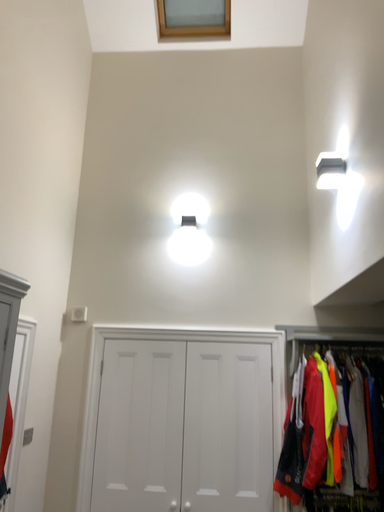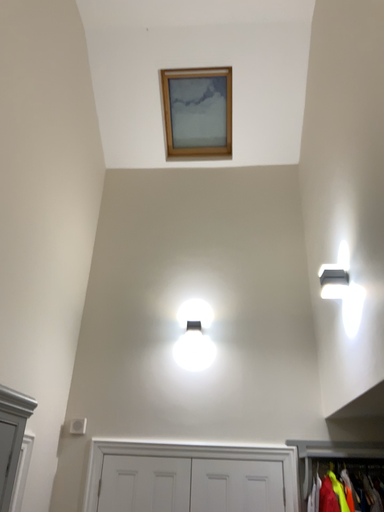
Question: Which way did the camera rotate in the video?

Choices:
 (A) rotated downward
 (B) rotated upward

Answer: (B)